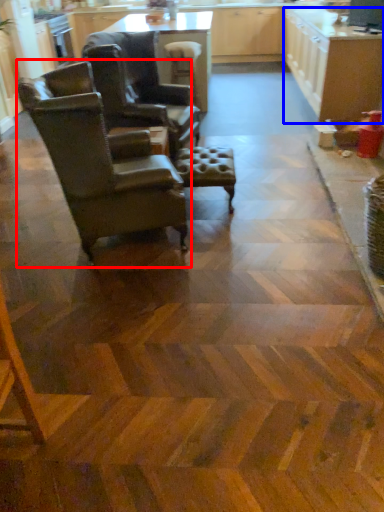
Question: Which object is closer to the camera taking this photo, chair (highlighted by a red box) or cabinetry (highlighted by a blue box)?

Choices:
 (A) chair
 (B) cabinetry

Answer: (A)